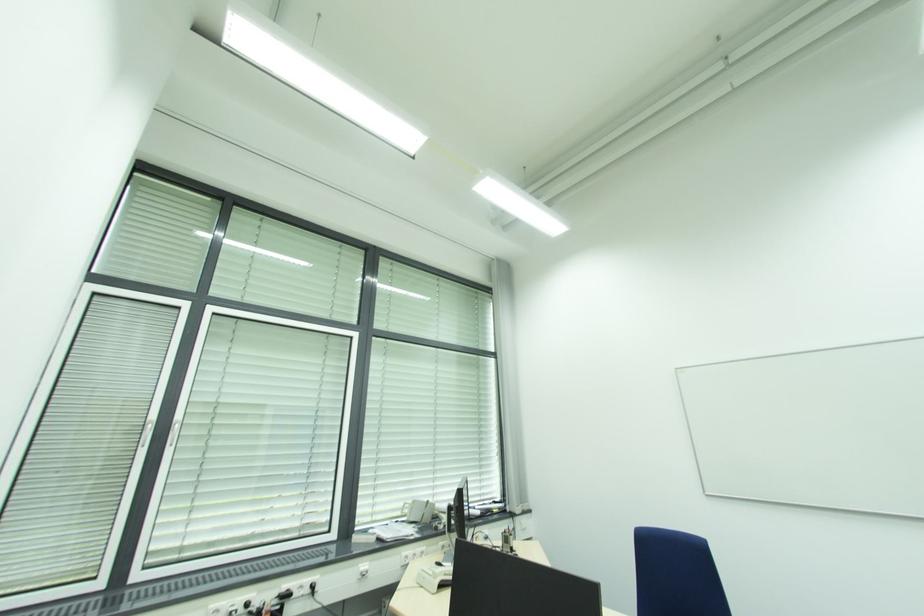
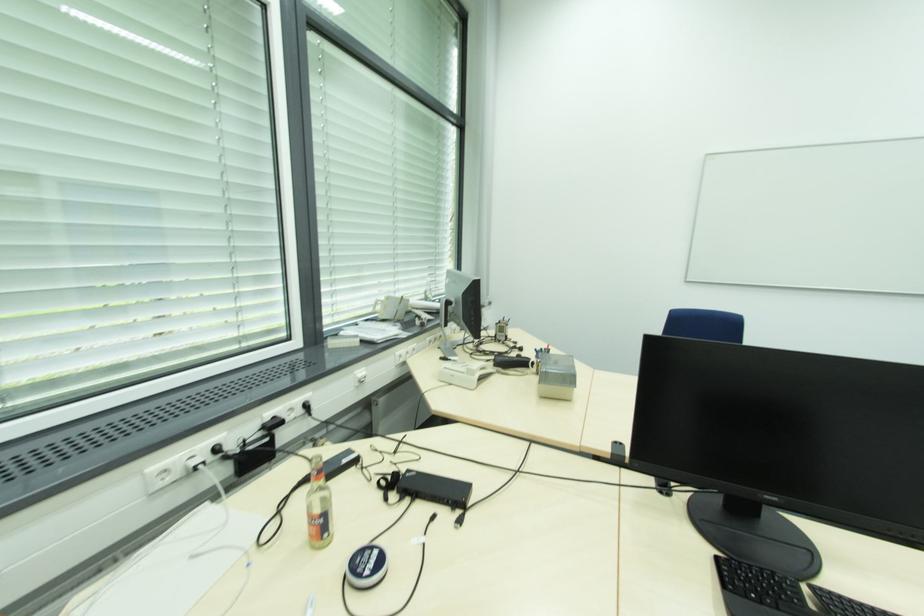
In the second image, find the point that corresponds to the point at 305,588 in the first image.

(294, 410)